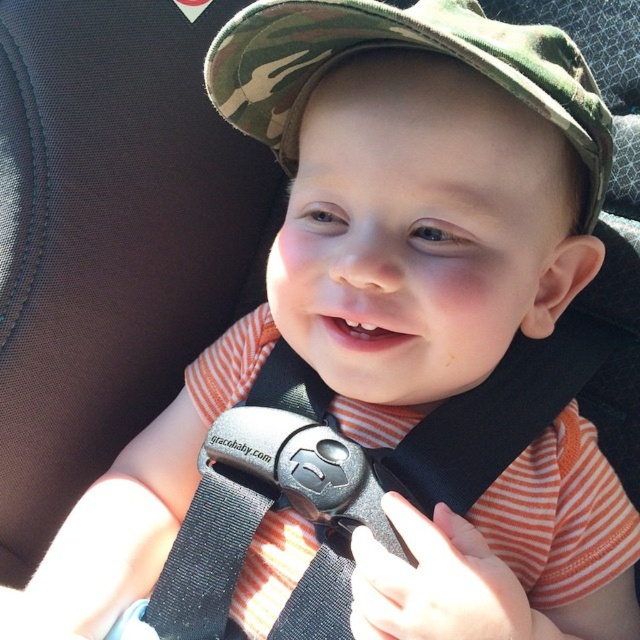
Based on the provided image, what are the coordinates of the black fabric seatbelt at center?

The coordinates of the black fabric seatbelt at center are at point (x=492, y=417).

You are designing a new car seat accessory that needs to fit between the black fabric seatbelt at center and the camo fabric hat at center. Given their sizes, which object should the accessory be designed around to ensure it fits properly?

The black fabric seatbelt at center has a larger width than the camo fabric hat at center, so the accessory should be designed around the black fabric seatbelt at center to ensure it accommodates the wider space between them.

You are a safety inspector checking the car seat setup. The black fabric seatbelt at center and the camo fabric hat at center are both visible. According to safety guidelines, the seatbelt should be positioned above the child. Is the current setup compliant with safety standards?

The black fabric seatbelt at center is located below the camo fabric hat at center, which means it is positioned below the child. This does not comply with safety standards as the seatbelt should be above the child.